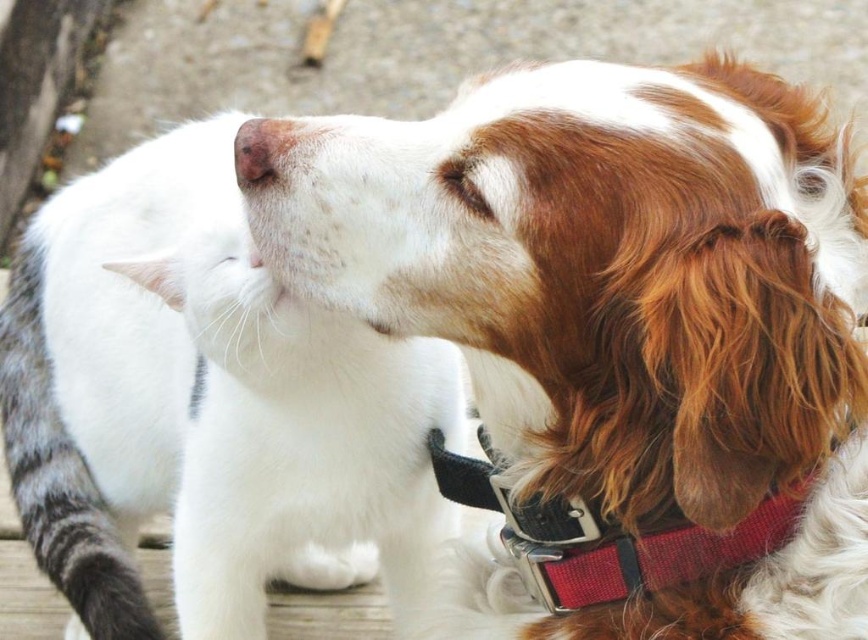
Question: Estimate the real-world distances between objects in this image. Which object is farther from the white fur cat at left?

Choices:
 (A) pink soft tissue at center
 (B) red fabric collar at right
 (C) white fur at center

Answer: (A)

Question: Is white fur at center wider than pink soft tissue at center?

Choices:
 (A) yes
 (B) no

Answer: (A)

Question: Which point appears farthest from the camera in this image?

Choices:
 (A) (549, 561)
 (B) (418, 332)
 (C) (123, 483)

Answer: (C)

Question: Which of the following is the closest to the observer?

Choices:
 (A) (285, 141)
 (B) (505, 186)
 (C) (800, 493)

Answer: (B)

Question: Is white fur cat at left to the left of red fabric collar at right from the viewer's perspective?

Choices:
 (A) yes
 (B) no

Answer: (A)

Question: Does white fur cat at left appear on the right side of pink soft tissue at center?

Choices:
 (A) yes
 (B) no

Answer: (B)